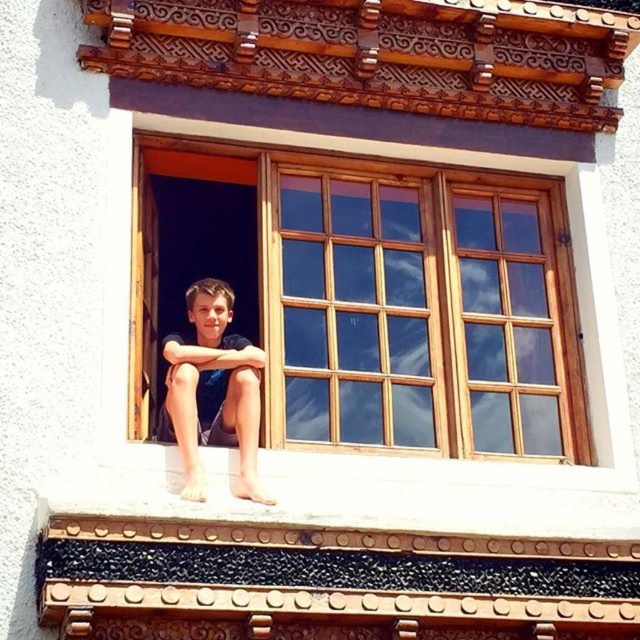
Question: Does wooden window at center appear on the right side of dark blue fabric shorts at center?

Choices:
 (A) yes
 (B) no

Answer: (A)

Question: Does wooden window at center have a smaller size compared to dark blue fabric shorts at center?

Choices:
 (A) yes
 (B) no

Answer: (B)

Question: Which object is closer to the camera taking this photo?

Choices:
 (A) wooden window at center
 (B) dark blue fabric shorts at center

Answer: (B)

Question: In this image, where is wooden window at center located relative to dark blue fabric shorts at center?

Choices:
 (A) above
 (B) below

Answer: (A)